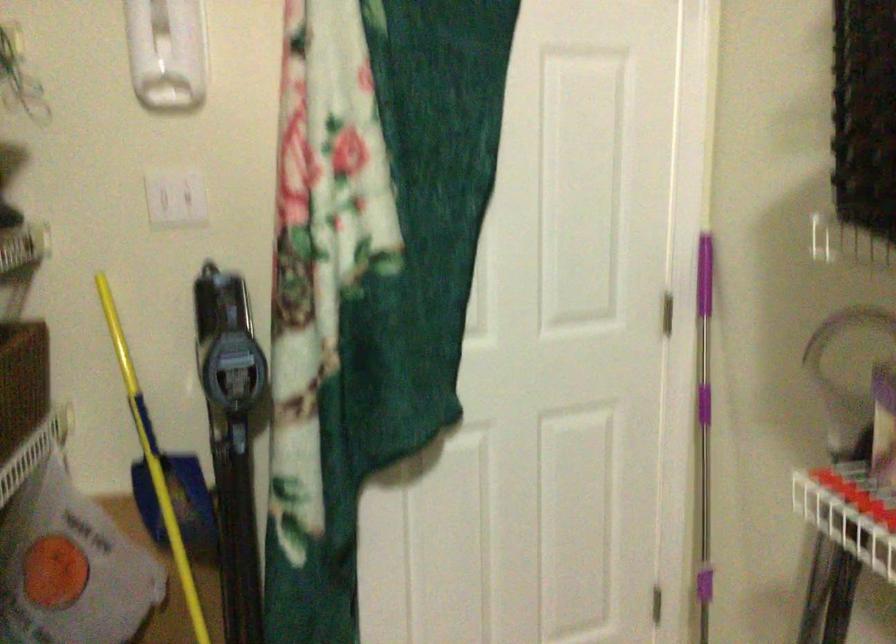
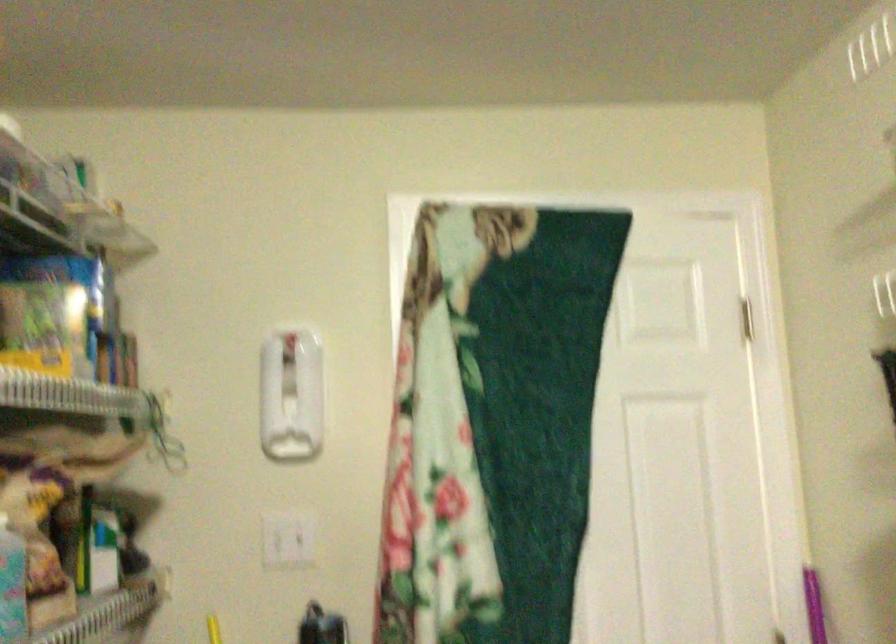
The point at (177, 204) is marked in the first image. Where is the corresponding point in the second image?

(288, 538)